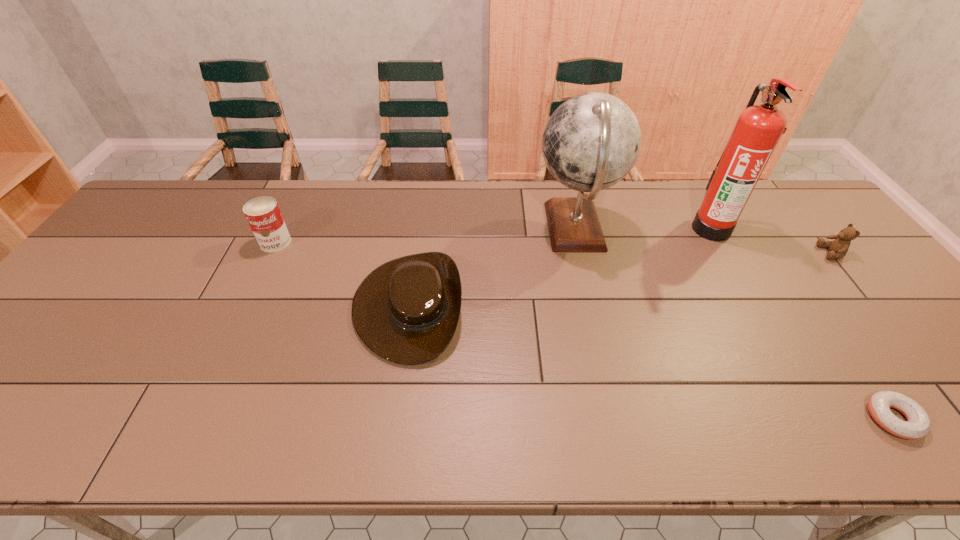
Identify the location of fire extinguisher located at the far edge. (758, 129).

Locate an element on the screen. Image resolution: width=960 pixels, height=540 pixels. globe that is at the far edge is located at coordinates (591, 142).

This screenshot has height=540, width=960. What are the coordinates of `object located in the near edge section of the desktop` in the screenshot? It's located at (917, 426).

You are a GUI agent. You are given a task and a screenshot of the screen. Output one action in this format:
    pyautogui.click(x=<x>, y=<y>)
    Task: Click on the object that is positioned at the right edge
    
    Given the screenshot: What is the action you would take?
    pyautogui.click(x=838, y=248)

At what (x,y) coordinates should I click in order to perform the action: click on blank space at the far edge of the desktop. Please return your answer as a coordinate pair (x, y). The width and height of the screenshot is (960, 540). Looking at the image, I should click on (361, 195).

Find the location of `free space at the near edge of the desktop`. free space at the near edge of the desktop is located at coordinates (182, 429).

The width and height of the screenshot is (960, 540). In order to click on free space at the left edge of the desktop in this screenshot , I will do `click(57, 339)`.

Where is `free space at the right edge of the desktop`? free space at the right edge of the desktop is located at coordinates point(860,272).

Where is `vacant space at the far right corner of the desktop`? The width and height of the screenshot is (960, 540). vacant space at the far right corner of the desktop is located at coordinates (790, 180).

The width and height of the screenshot is (960, 540). Find the location of `vacant space that's between the doughnut and the third tallest object`. vacant space that's between the doughnut and the third tallest object is located at coordinates (584, 330).